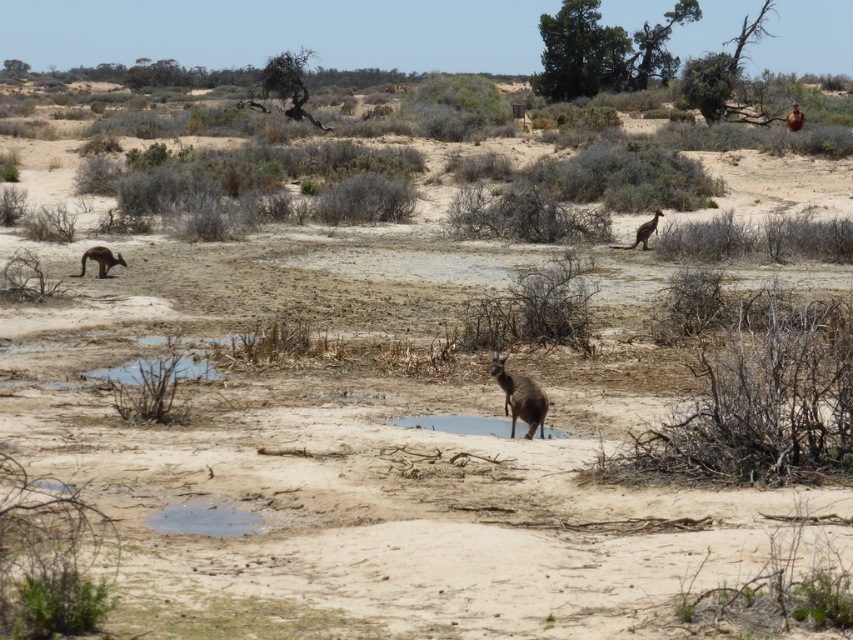
Question: Which point is farther to the camera?

Choices:
 (A) (102, 252)
 (B) (506, 426)
 (C) (538, 388)
 (D) (647, 237)

Answer: (D)

Question: Is clear water at center positioned before brown fur kangaroo at left?

Choices:
 (A) no
 (B) yes

Answer: (B)

Question: Which point is farther to the camera?

Choices:
 (A) click(x=468, y=429)
 (B) click(x=105, y=268)
 (C) click(x=517, y=388)

Answer: (B)

Question: Which of the following is the farthest from the observer?

Choices:
 (A) (497, 369)
 (B) (440, 417)

Answer: (B)

Question: Can you confirm if brown fur kangaroo at left is smaller than brown fur kangaroo at upper right?

Choices:
 (A) yes
 (B) no

Answer: (A)

Question: Considering the relative positions of brown furry kangaroo at center and brown fur kangaroo at left in the image provided, where is brown furry kangaroo at center located with respect to brown fur kangaroo at left?

Choices:
 (A) left
 (B) right

Answer: (B)